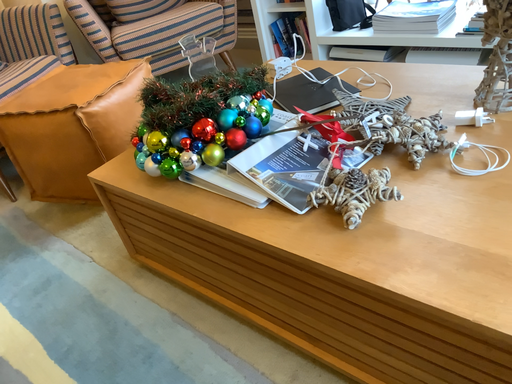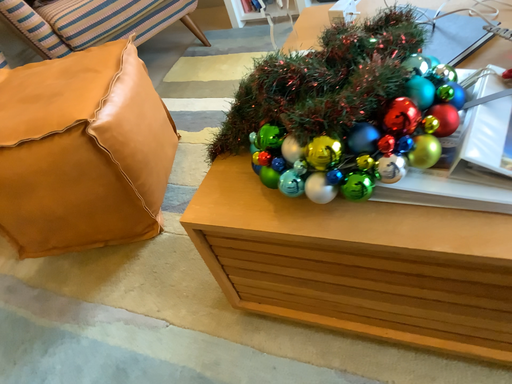
Question: How did the camera likely rotate when shooting the video?

Choices:
 (A) rotated left
 (B) rotated right

Answer: (B)